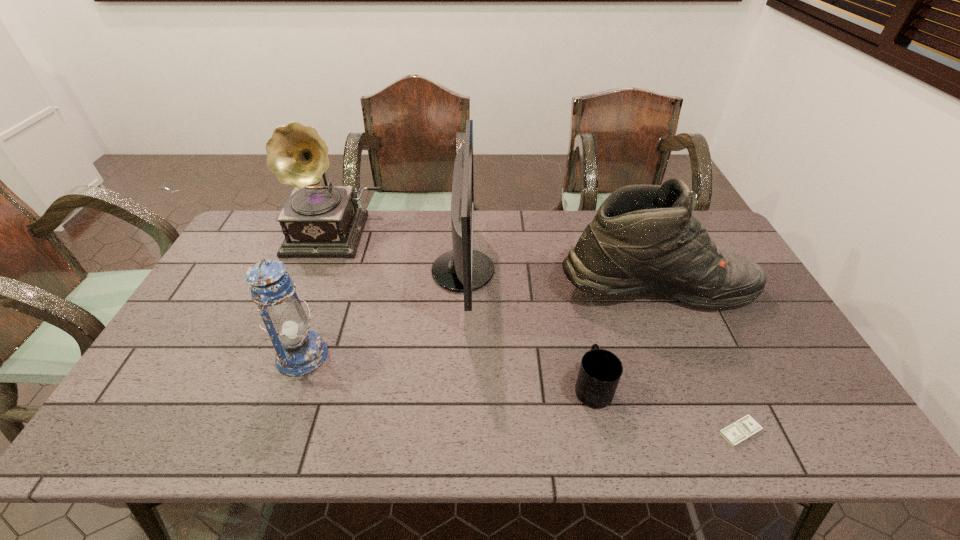
The width and height of the screenshot is (960, 540). I want to click on blank space located on the front-facing side of the lantern, so click(358, 355).

At what (x,y) coordinates should I click in order to perform the action: click on free location located on the side of the fifth tallest object with the handle. Please return your answer as a coordinate pair (x, y). The image size is (960, 540). Looking at the image, I should click on (575, 304).

You are a GUI agent. You are given a task and a screenshot of the screen. Output one action in this format:
    pyautogui.click(x=<x>, y=<y>)
    Task: Click on the vacant space located on the side of the fifth tallest object with the handle
    The width and height of the screenshot is (960, 540).
    Given the screenshot: What is the action you would take?
    pyautogui.click(x=569, y=281)

What are the coordinates of `free spot located 0.210m on the side of the fifth tallest object with the handle` in the screenshot? It's located at (575, 307).

Image resolution: width=960 pixels, height=540 pixels. What are the coordinates of `free location located 0.110m on the right of the shortest object` in the screenshot? It's located at (810, 432).

Locate an element on the screen. record player positioned at the far edge is located at coordinates (316, 220).

Where is `monitor that is at the far edge`? Image resolution: width=960 pixels, height=540 pixels. monitor that is at the far edge is located at coordinates (463, 269).

Find the location of `object at the near edge`. object at the near edge is located at coordinates (744, 428).

The image size is (960, 540). What are the coordinates of `object at the right edge` in the screenshot? It's located at click(644, 237).

You are a GUI agent. You are given a task and a screenshot of the screen. Output one action in this format:
    pyautogui.click(x=<x>, y=<y>)
    Task: Click on the free space at the far edge of the desktop
    Image resolution: width=960 pixels, height=540 pixels.
    Given the screenshot: What is the action you would take?
    pyautogui.click(x=513, y=211)